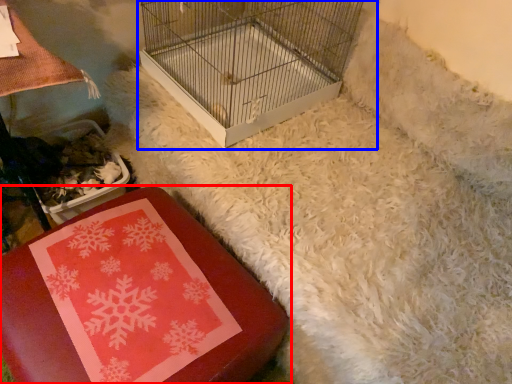
Question: Which object is further to the camera taking this photo, furniture (highlighted by a red box) or bird cage (highlighted by a blue box)?

Choices:
 (A) furniture
 (B) bird cage

Answer: (B)